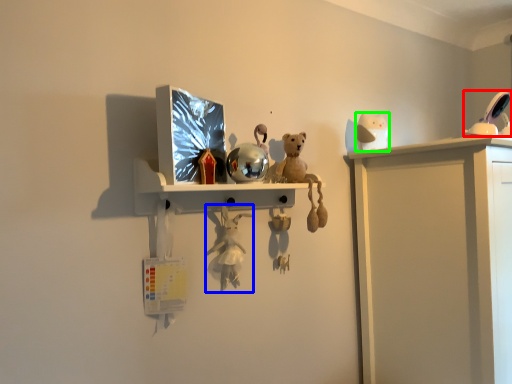
Question: Estimate the real-world distances between objects in this image. Which object is farther from toy (highlighted by a red box), toy (highlighted by a blue box) or toy (highlighted by a green box)?

Choices:
 (A) toy
 (B) toy

Answer: (A)